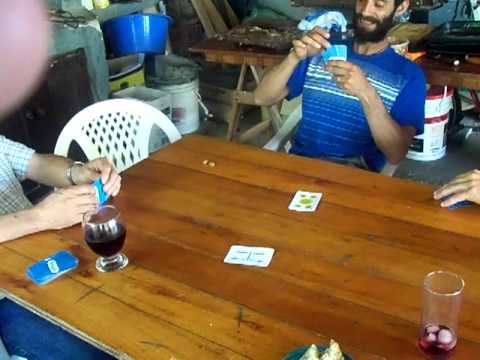
I want to click on wall, so click(x=16, y=70).